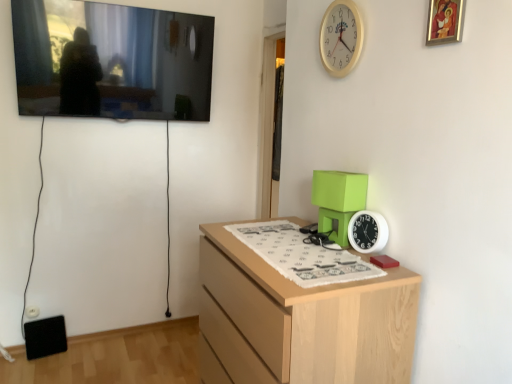
The height and width of the screenshot is (384, 512). I want to click on vacant space underneath flat screen tv at upper left, placed as the first picture frame when sorted from left to right (from a real-world perspective), so click(137, 334).